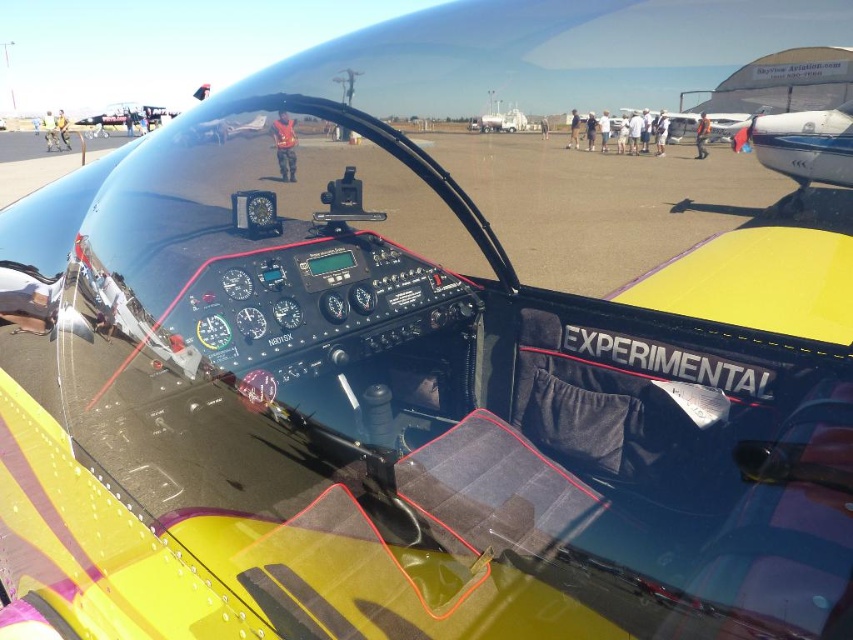
Can you confirm if metallic blue propeller at right is wider than yellow matte airplane at center?

Correct, the width of metallic blue propeller at right exceeds that of yellow matte airplane at center.

Who is shorter, metallic blue propeller at right or yellow matte airplane at center?

yellow matte airplane at center

Between point (816, 145) and point (697, 116), which one is positioned behind?

Positioned behind is point (697, 116).

Find the location of `metallic blue propeller at right`. metallic blue propeller at right is located at coordinates (802, 148).

Does yellow matte airplane at center have a smaller size compared to red fabric jacket at center?

No, yellow matte airplane at center is not smaller than red fabric jacket at center.

Can you confirm if yellow matte airplane at center is positioned below red fabric jacket at center?

Incorrect, yellow matte airplane at center is not positioned below red fabric jacket at center.

Is point (732, 115) farther from viewer compared to point (283, 120)?

Yes, point (732, 115) is farther from viewer.

You are a GUI agent. You are given a task and a screenshot of the screen. Output one action in this format:
    pyautogui.click(x=<x>, y=<y>)
    Task: Click on the yellow matte airplane at center
    
    Given the screenshot: What is the action you would take?
    pyautogui.click(x=724, y=124)

From the picture: Who is more forward, (766, 120) or (277, 124)?

Point (277, 124) is more forward.

Can you confirm if metallic blue propeller at right is wider than red fabric jacket at center?

Yes.

Is point (846, 140) in front of point (285, 154)?

No, it is not.

This screenshot has height=640, width=853. I want to click on metallic blue propeller at right, so click(802, 148).